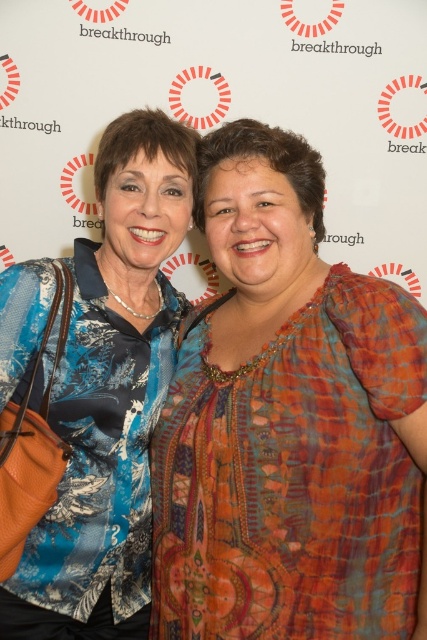
Can you confirm if textured orange blouse at center is positioned to the right of blue printed fabric at left?

Correct, you'll find textured orange blouse at center to the right of blue printed fabric at left.

Is textured orange blouse at center to the left of blue printed fabric at left from the viewer's perspective?

No, textured orange blouse at center is not to the left of blue printed fabric at left.

Does point (173, 484) lie in front of point (140, 330)?

Yes, it is in front of point (140, 330).

Where is `textured orange blouse at center`? The width and height of the screenshot is (427, 640). textured orange blouse at center is located at coordinates (289, 422).